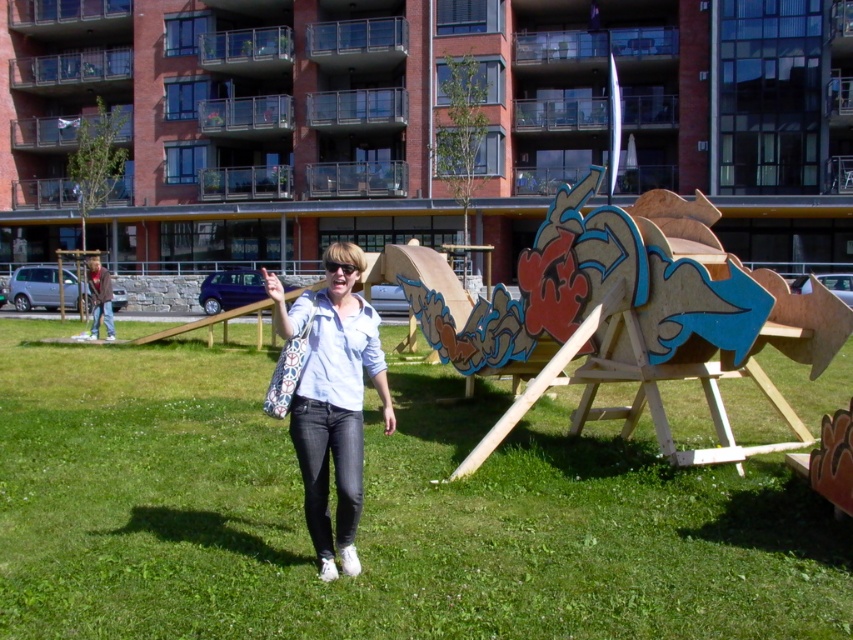
Question: Which of these objects is positioned closest to the matte white shirt at center?

Choices:
 (A) wooden sculpture at center
 (B) green grass at center

Answer: (A)

Question: Can you confirm if green grass at center is positioned to the left of wooden sculpture at center?

Choices:
 (A) no
 (B) yes

Answer: (A)

Question: Which of these objects is positioned closest to the green grass at center?

Choices:
 (A) wooden sculpture at center
 (B) matte white shirt at center

Answer: (B)

Question: Is green grass at center positioned before wooden sculpture at center?

Choices:
 (A) no
 (B) yes

Answer: (B)

Question: Which object is the closest to the green grass at center?

Choices:
 (A) wooden sculpture at center
 (B) matte white shirt at center

Answer: (B)

Question: Does wooden sculpture at center appear over matte white shirt at center?

Choices:
 (A) no
 (B) yes

Answer: (B)